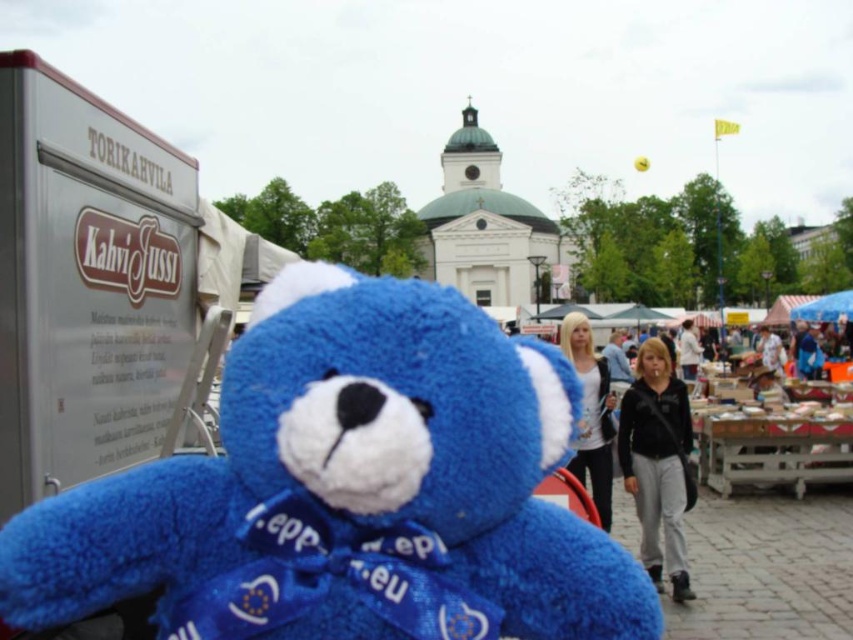
Can you confirm if black fleece jacket at center is positioned to the right of white cotton shirt at center?

Indeed, black fleece jacket at center is positioned on the right side of white cotton shirt at center.

This screenshot has width=853, height=640. I want to click on black fleece jacket at center, so click(x=657, y=461).

Which is behind, point (666, 490) or point (596, 420)?

Positioned behind is point (596, 420).

Image resolution: width=853 pixels, height=640 pixels. Identify the location of black fleece jacket at center. (657, 461).

Does black fleece jacket at center have a lesser height compared to light brown hair at center?

In fact, black fleece jacket at center may be taller than light brown hair at center.

Is point (659, 532) closer to camera compared to point (763, 358)?

Yes.

You are a GUI agent. You are given a task and a screenshot of the screen. Output one action in this format:
    pyautogui.click(x=<x>, y=<y>)
    Task: Click on the black fleece jacket at center
    This screenshot has width=853, height=640.
    Given the screenshot: What is the action you would take?
    pyautogui.click(x=657, y=461)

Does blue plush bear at center have a larger size compared to white cotton shirt at center?

Yes.

Is point (238, 396) positioned behind point (596, 368)?

That is False.

What are the coordinates of `blue plush bear at center` in the screenshot? It's located at (347, 490).